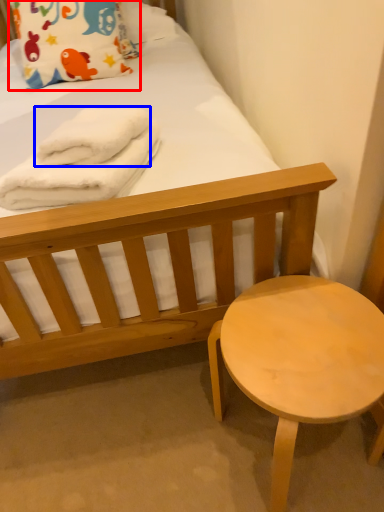
Question: Among these objects, which one is farthest to the camera, pillow (highlighted by a red box) or bath towel (highlighted by a blue box)?

Choices:
 (A) pillow
 (B) bath towel

Answer: (A)